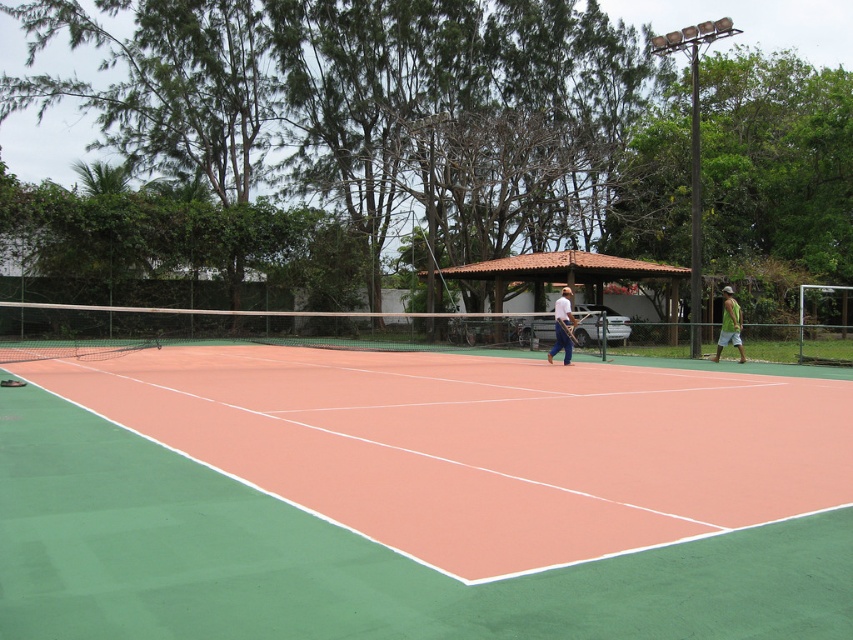
You are a tennis player trying to store your equipment in a bag that can only accommodate items up to the size of the wooden tennis racket at center. Can your green fabric shorts at right fit into the bag?

The green fabric shorts at right are wider than the wooden tennis racket at center, so they cannot fit into the bag designed for items up to the racket size.